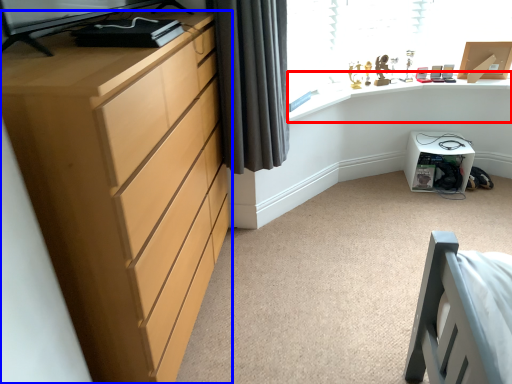
Question: Which object appears closest to the camera in this image, computer desk (highlighted by a red box) or chest of drawers (highlighted by a blue box)?

Choices:
 (A) computer desk
 (B) chest of drawers

Answer: (B)